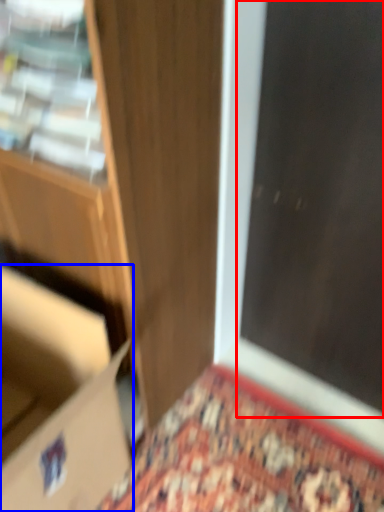
Question: Which point is further to the camera, screen door (highlighted by a red box) or cardboard box (highlighted by a blue box)?

Choices:
 (A) screen door
 (B) cardboard box

Answer: (A)